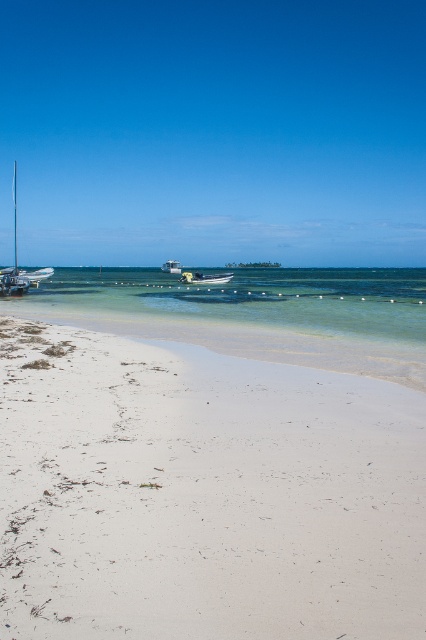
Measure the distance between point (201, 276) and camera.

A distance of 59.59 meters exists between point (201, 276) and camera.

Who is more distant from viewer, [183,275] or [48,268]?

The point [48,268] is more distant.

Where is `white plastic boat at center`? Image resolution: width=426 pixels, height=640 pixels. white plastic boat at center is located at coordinates (204, 276).

Is white sandy beach at lower left closer to the viewer compared to white matte boat at center?

Yes, it is in front of white matte boat at center.

Between point (313, 458) and point (166, 268), which one is positioned in front?

Point (313, 458)

The height and width of the screenshot is (640, 426). Identify the location of white sandy beach at lower left. (203, 493).

Can you confirm if white plastic boat at center is bigger than white matte boat at center?

→ Incorrect, white plastic boat at center is not larger than white matte boat at center.

Looking at this image, does white plastic boat at center appear on the right side of white matte boat at center?

Yes, white plastic boat at center is to the right of white matte boat at center.

Which is behind, point (192, 280) or point (172, 264)?

Positioned behind is point (172, 264).

At what (x,y) coordinates should I click in order to perform the action: click on white plastic boat at center. Please return your answer as a coordinate pair (x, y). Looking at the image, I should click on (204, 276).